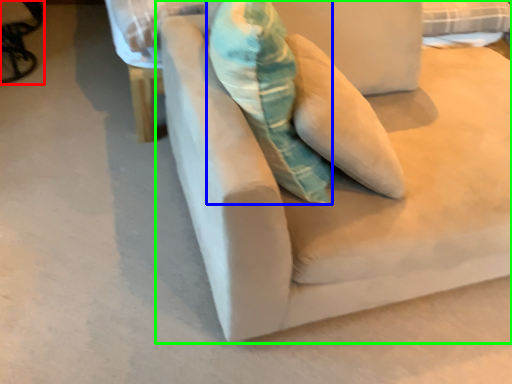
Question: Which object is the closest to the swivel chair (highlighted by a red box)? Choose among these: throw pillow (highlighted by a blue box) or studio couch (highlighted by a green box).

Choices:
 (A) throw pillow
 (B) studio couch

Answer: (A)